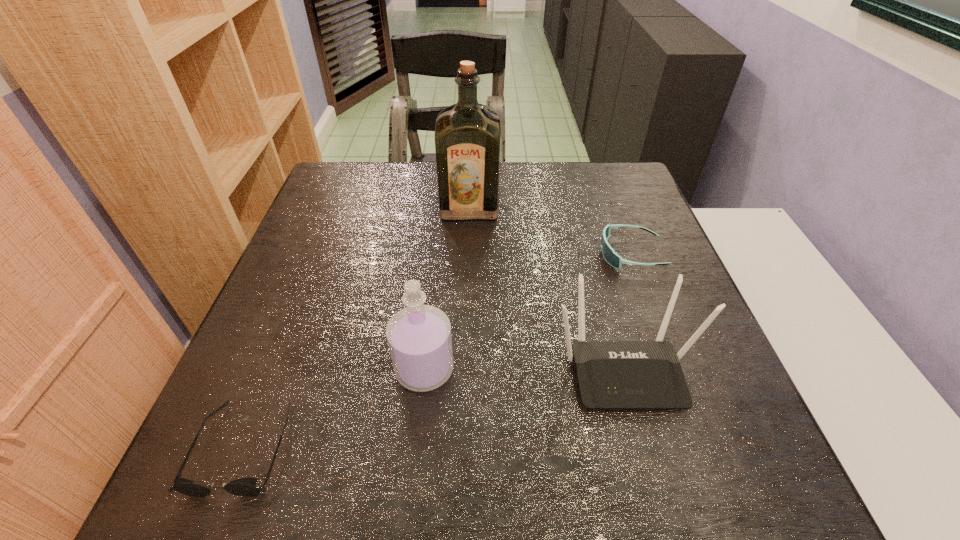
Find the location of a particular element. The width and height of the screenshot is (960, 540). vacant space positioned 0.270m on the front-facing side of the fourth nearest object is located at coordinates (485, 254).

The height and width of the screenshot is (540, 960). What are the coordinates of `free space located 0.190m on the front-facing side of the fourth nearest object` in the screenshot? It's located at (519, 254).

At what (x,y) coordinates should I click in order to perform the action: click on object positioned at the far edge. Please return your answer as a coordinate pair (x, y). Looking at the image, I should click on (467, 134).

At what (x,y) coordinates should I click in order to perform the action: click on object situated at the near edge. Please return your answer as a coordinate pair (x, y). Looking at the image, I should click on (245, 487).

Where is `object that is at the left edge`? The width and height of the screenshot is (960, 540). object that is at the left edge is located at coordinates (245, 487).

Find the location of a particular element. This screenshot has width=960, height=540. router at the right edge is located at coordinates (611, 374).

At what (x,y) coordinates should I click in order to perform the action: click on goggles positioned at the right edge. Please return your answer as a coordinate pair (x, y). This screenshot has height=540, width=960. Looking at the image, I should click on [613, 259].

This screenshot has width=960, height=540. What are the coordinates of `object at the near left corner` in the screenshot? It's located at (245, 487).

Locate an element on the screen. The width and height of the screenshot is (960, 540). free space at the far edge is located at coordinates (509, 179).

Where is `free point at the near edge`? The height and width of the screenshot is (540, 960). free point at the near edge is located at coordinates point(474,496).